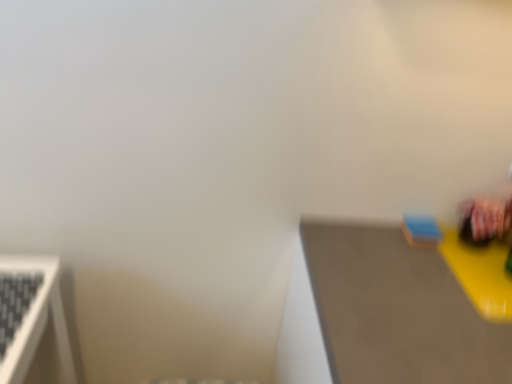
Question: Can you confirm if smooth gray table at right is bigger than blue matte sponge at upper right, placed as the 2th toy when sorted from right to left?

Choices:
 (A) no
 (B) yes

Answer: (B)

Question: Considering the relative positions of smooth gray table at right and blue matte sponge at upper right, which is the first toy in left-to-right order, in the image provided, is smooth gray table at right behind blue matte sponge at upper right, which is the first toy in left-to-right order,?

Choices:
 (A) no
 (B) yes

Answer: (A)

Question: Can you confirm if smooth gray table at right is wider than blue matte sponge at upper right, which is the first toy in left-to-right order?

Choices:
 (A) no
 (B) yes

Answer: (B)

Question: Can you confirm if smooth gray table at right is positioned to the right of blue matte sponge at upper right, which is the first toy in left-to-right order?

Choices:
 (A) yes
 (B) no

Answer: (A)

Question: From the image's perspective, is smooth gray table at right over blue matte sponge at upper right, which is the first toy in left-to-right order?

Choices:
 (A) no
 (B) yes

Answer: (A)

Question: Visually, is blue matte sponge at upper right, which is the first toy in left-to-right order, positioned to the left or to the right of smooth gray table at right?

Choices:
 (A) left
 (B) right

Answer: (A)

Question: Based on their sizes in the image, would you say blue matte sponge at upper right, placed as the 2th toy when sorted from right to left, is bigger or smaller than smooth gray table at right?

Choices:
 (A) big
 (B) small

Answer: (B)

Question: Is blue matte sponge at upper right, which is the first toy in left-to-right order, inside the boundaries of smooth gray table at right, or outside?

Choices:
 (A) outside
 (B) inside

Answer: (A)

Question: Relative to smooth gray table at right, is blue matte sponge at upper right, placed as the 2th toy when sorted from right to left, in front or behind?

Choices:
 (A) behind
 (B) front

Answer: (A)

Question: Considering the positions of matte plastic toy at right, which appears as the 2th toy when viewed from the left, and blue matte sponge at upper right, which is the first toy in left-to-right order, in the image, is matte plastic toy at right, which appears as the 2th toy when viewed from the left, wider or thinner than blue matte sponge at upper right, which is the first toy in left-to-right order,?

Choices:
 (A) wide
 (B) thin

Answer: (A)

Question: Is matte plastic toy at right, which is counted as the 1th toy, starting from the right, inside the boundaries of blue matte sponge at upper right, placed as the 2th toy when sorted from right to left, or outside?

Choices:
 (A) inside
 (B) outside

Answer: (B)

Question: From their relative heights in the image, would you say matte plastic toy at right, which is counted as the 1th toy, starting from the right, is taller or shorter than blue matte sponge at upper right, placed as the 2th toy when sorted from right to left?

Choices:
 (A) short
 (B) tall

Answer: (B)

Question: From a real-world perspective, relative to blue matte sponge at upper right, which is the first toy in left-to-right order, is matte plastic toy at right, which appears as the 2th toy when viewed from the left, vertically above or below?

Choices:
 (A) above
 (B) below

Answer: (A)

Question: Considering the relative positions of matte plastic toy at right, which appears as the 2th toy when viewed from the left, and smooth gray table at right in the image provided, is matte plastic toy at right, which appears as the 2th toy when viewed from the left, to the left or to the right of smooth gray table at right?

Choices:
 (A) left
 (B) right

Answer: (B)

Question: Which is correct: matte plastic toy at right, which is counted as the 1th toy, starting from the right, is inside smooth gray table at right, or outside of it?

Choices:
 (A) inside
 (B) outside

Answer: (B)